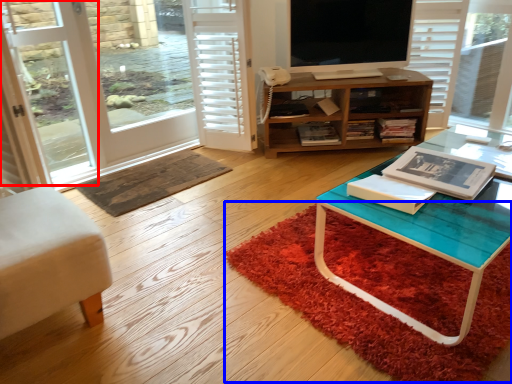
Question: Which point is further to the camera, screen door (highlighted by a red box) or doormat (highlighted by a blue box)?

Choices:
 (A) screen door
 (B) doormat

Answer: (A)